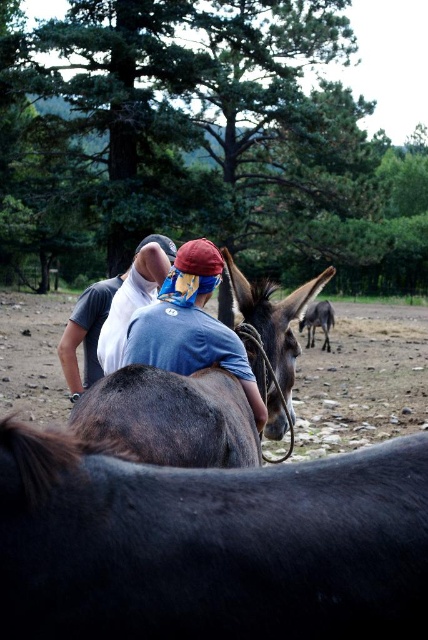
Question: Which of these objects is positioned farthest from the white cotton shirt at center?

Choices:
 (A) brown matte mule at center
 (B) dark brown leather mule at center

Answer: (B)

Question: Which point appears farthest from the camera in this image?

Choices:
 (A) (287, 397)
 (B) (139, 397)
 (C) (226, 358)
 (D) (95, 308)

Answer: (D)

Question: Is white cotton shirt at center behind dark brown fur at center?

Choices:
 (A) no
 (B) yes

Answer: (A)

Question: Can you confirm if black smooth mule at center is positioned to the right of blue fabric bandana at center?

Choices:
 (A) yes
 (B) no

Answer: (A)

Question: Which point is farther to the camera?

Choices:
 (A) white fabric at center
 (B) blue fabric bandana at center

Answer: (A)

Question: Does black smooth mule at center have a greater width compared to dark brown leather mule at center?

Choices:
 (A) yes
 (B) no

Answer: (A)